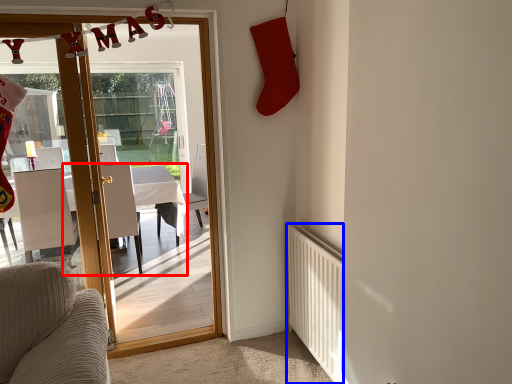
Question: Among these objects, which one is farthest to the camera, table (highlighted by a red box) or radiator (highlighted by a blue box)?

Choices:
 (A) table
 (B) radiator

Answer: (A)